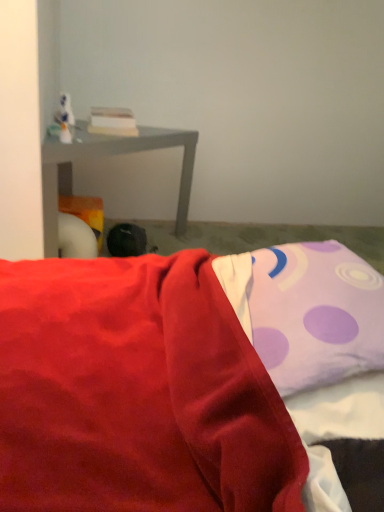
Measure the distance between point (x=154, y=145) and camera.

Point (x=154, y=145) is 1.51 meters away from camera.

Find the location of a particular element. matte gray table at left is located at coordinates (108, 155).

Is matte gray table at left bigger or smaller than purple dotted pillow at upper right?

In the image, matte gray table at left appears to be larger than purple dotted pillow at upper right.

Which is more to the left, matte gray table at left or purple dotted pillow at upper right?

matte gray table at left is more to the left.

From a real-world perspective, is matte gray table at left positioned over purple dotted pillow at upper right based on gravity?

No, from a real-world perspective, matte gray table at left is not over purple dotted pillow at upper right

Which of these two, matte gray table at left or purple dotted pillow at upper right, stands taller?

matte gray table at left.

From the picture: Which is correct: black fabric bean bag at center is inside matte gray table at left, or outside of it?

black fabric bean bag at center fits inside matte gray table at left.

Between black fabric bean bag at center and matte gray table at left, which one has larger width?

With larger width is matte gray table at left.

Is black fabric bean bag at center further to camera compared to matte gray table at left?

That is True.

Which is further, (127, 234) or (46, 167)?

The point (127, 234) is behind.

From a real-world perspective, is black fabric bean bag at center positioned under purple dotted pillow at upper right based on gravity?

Indeed, from a real-world perspective, black fabric bean bag at center is positioned beneath purple dotted pillow at upper right.

Considering the positions of objects black fabric bean bag at center and purple dotted pillow at upper right in the image provided, who is more to the left, black fabric bean bag at center or purple dotted pillow at upper right?

black fabric bean bag at center.

From the image's perspective, who appears lower, black fabric bean bag at center or purple dotted pillow at upper right?

purple dotted pillow at upper right appears lower in the image.

Is point (184, 222) closer or farther from the camera than point (119, 232)?

Point (184, 222).

In terms of size, does matte gray table at left appear bigger or smaller than black fabric bean bag at center?

Considering their sizes, matte gray table at left takes up more space than black fabric bean bag at center.

In the image, is matte gray table at left positioned in front of or behind black fabric bean bag at center?

In the image, matte gray table at left appears in front of black fabric bean bag at center.

Would you say black fabric bean bag at center is part of matte gray table at left's contents?

Absolutely, black fabric bean bag at center is inside matte gray table at left.

Considering the sizes of objects purple dotted pillow at upper right and black fabric bean bag at center in the image provided, who is taller, purple dotted pillow at upper right or black fabric bean bag at center?

With more height is purple dotted pillow at upper right.

How far apart are purple dotted pillow at upper right and black fabric bean bag at center?

purple dotted pillow at upper right and black fabric bean bag at center are 32.37 inches apart from each other.

Find the location of a particular element. The width and height of the screenshot is (384, 512). pillow above the black fabric bean bag at center (from a real-world perspective) is located at coordinates (315, 314).

Is purple dotted pillow at upper right far away from black fabric bean bag at center?

No.

From a real-world perspective, who is located higher, purple dotted pillow at upper right or matte gray table at left?

From a 3D spatial view, purple dotted pillow at upper right is above.

Is purple dotted pillow at upper right aimed at matte gray table at left?

No, purple dotted pillow at upper right is not aimed at matte gray table at left.

Considering the sizes of objects purple dotted pillow at upper right and matte gray table at left in the image provided, who is bigger, purple dotted pillow at upper right or matte gray table at left?

matte gray table at left is bigger.

Is the surface of purple dotted pillow at upper right in direct contact with matte gray table at left?

No, purple dotted pillow at upper right is not beside matte gray table at left.

Identify the location of pillow below the matte gray table at left (from the image's perspective). This screenshot has width=384, height=512. (315, 314).

Locate an element on the screen. Image resolution: width=384 pixels, height=512 pixels. table located above the black fabric bean bag at center (from a real-world perspective) is located at coordinates (108, 155).

Which object lies nearer to the anchor point matte gray table at left, black fabric bean bag at center or purple dotted pillow at upper right?

The object closer to matte gray table at left is black fabric bean bag at center.

Estimate the real-world distances between objects in this image. Which object is closer to purple dotted pillow at upper right, matte gray table at left or black fabric bean bag at center?

Based on the image, black fabric bean bag at center appears to be nearer to purple dotted pillow at upper right.

When comparing their distances from black fabric bean bag at center, does matte gray table at left or purple dotted pillow at upper right seem further?

purple dotted pillow at upper right lies further to black fabric bean bag at center than the other object.

In the scene shown: Looking at the image, which one is located closer to matte gray table at left, purple dotted pillow at upper right or black fabric bean bag at center?

black fabric bean bag at center is positioned closer to the anchor matte gray table at left.

Considering their positions, is purple dotted pillow at upper right positioned further to black fabric bean bag at center than matte gray table at left?

The object further to black fabric bean bag at center is purple dotted pillow at upper right.

In the scene shown: Which object lies further to the anchor point purple dotted pillow at upper right, black fabric bean bag at center or matte gray table at left?

Based on the image, matte gray table at left appears to be further to purple dotted pillow at upper right.

Where is `table between purple dotted pillow at upper right and black fabric bean bag at center from front to back`? This screenshot has width=384, height=512. table between purple dotted pillow at upper right and black fabric bean bag at center from front to back is located at coordinates click(x=108, y=155).